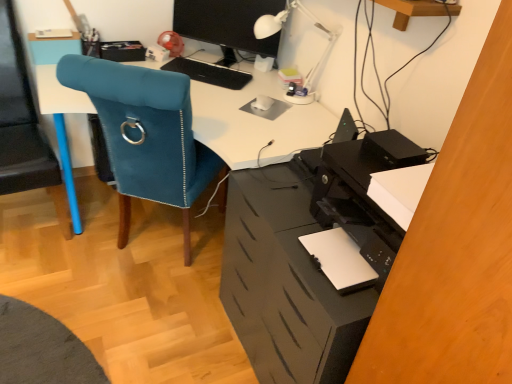
Question: Would you say velvet blue chair at left is outside black matte keyboard at center?

Choices:
 (A) yes
 (B) no

Answer: (A)

Question: Does velvet blue chair at left come in front of black matte keyboard at center?

Choices:
 (A) no
 (B) yes

Answer: (B)

Question: Is velvet blue chair at left facing away from black matte keyboard at center?

Choices:
 (A) yes
 (B) no

Answer: (B)

Question: From the image's perspective, is velvet blue chair at left beneath black matte keyboard at center?

Choices:
 (A) no
 (B) yes

Answer: (B)

Question: Is velvet blue chair at left taller than black matte keyboard at center?

Choices:
 (A) yes
 (B) no

Answer: (A)

Question: From a real-world perspective, is black matte keyboard at center above or below matte black monitor at upper center?

Choices:
 (A) above
 (B) below

Answer: (B)

Question: Is point (245, 74) closer or farther from the camera than point (245, 1)?

Choices:
 (A) farther
 (B) closer

Answer: (A)

Question: Visually, is black matte keyboard at center positioned to the left or to the right of matte black monitor at upper center?

Choices:
 (A) left
 (B) right

Answer: (A)

Question: Is black matte keyboard at center bigger or smaller than matte black monitor at upper center?

Choices:
 (A) big
 (B) small

Answer: (B)

Question: In the image, is black matte keyboard at center on the left side or the right side of white plastic table lamp at upper center?

Choices:
 (A) right
 (B) left

Answer: (B)

Question: Looking at the image, does black matte keyboard at center seem bigger or smaller compared to white plastic table lamp at upper center?

Choices:
 (A) big
 (B) small

Answer: (B)

Question: From a real-world perspective, is black matte keyboard at center above or below white plastic table lamp at upper center?

Choices:
 (A) above
 (B) below

Answer: (B)

Question: In the image, is black matte keyboard at center positioned in front of or behind white plastic table lamp at upper center?

Choices:
 (A) behind
 (B) front

Answer: (A)

Question: Relative to blue fabric chair at left, is white plastic table lamp at upper center in front or behind?

Choices:
 (A) front
 (B) behind

Answer: (B)

Question: Is white plastic table lamp at upper center taller or shorter than blue fabric chair at left?

Choices:
 (A) tall
 (B) short

Answer: (B)